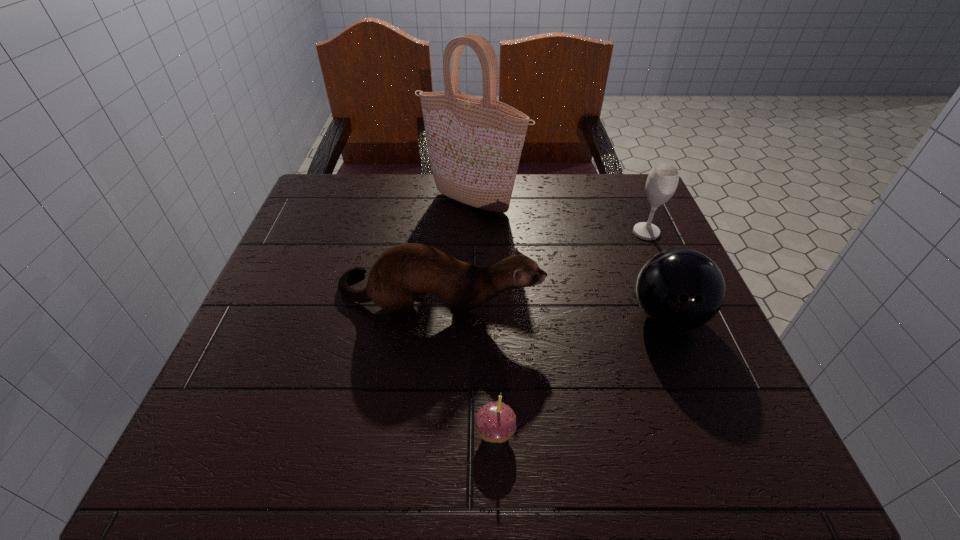
You are a GUI agent. You are given a task and a screenshot of the screen. Output one action in this format:
    pyautogui.click(x=<x>, y=<y>)
    Task: Click on the free area in between the bowling ball and the nearest object
    
    Given the screenshot: What is the action you would take?
    pyautogui.click(x=581, y=374)

Where is `unoccupied position between the cupcake and the bowling ball`? unoccupied position between the cupcake and the bowling ball is located at coordinates (581, 374).

You are a GUI agent. You are given a task and a screenshot of the screen. Output one action in this format:
    pyautogui.click(x=<x>, y=<y>)
    Task: Click on the empty space that is in between the shortest object and the tallest object
    This screenshot has width=960, height=540.
    Given the screenshot: What is the action you would take?
    pyautogui.click(x=484, y=318)

Identify the location of free space between the ferret and the shopping bag. The image size is (960, 540). (455, 251).

Identify which object is the nearest to the bowling ball. Please provide its 2D coordinates. Your answer should be formatted as a tuple, i.e. [(x, y)], where the tuple contains the x and y coordinates of a point satisfying the conditions above.

[(662, 181)]

Find the location of `object that ranks as the closest to the bowling ball`. object that ranks as the closest to the bowling ball is located at coordinates (662, 181).

Identify the location of vacant space that satisfies the following two spatial constraints: 1. on the front side of the second farthest object; 2. on the right side of the farthest object. (473, 232).

The height and width of the screenshot is (540, 960). In order to click on free space that satisfies the following two spatial constraints: 1. at the face of the cupcake; 2. on the left side of the ferret in this screenshot , I will do tap(425, 432).

This screenshot has width=960, height=540. Find the location of `free location that satisfies the following two spatial constraints: 1. on the front side of the farthest object; 2. at the face of the ferret`. free location that satisfies the following two spatial constraints: 1. on the front side of the farthest object; 2. at the face of the ferret is located at coordinates (471, 299).

You are a GUI agent. You are given a task and a screenshot of the screen. Output one action in this format:
    pyautogui.click(x=<x>, y=<y>)
    Task: Click on the vacant space that satisfies the following two spatial constraints: 1. on the front side of the wineglass; 2. at the face of the ferret
    The image size is (960, 540).
    Given the screenshot: What is the action you would take?
    pyautogui.click(x=675, y=299)